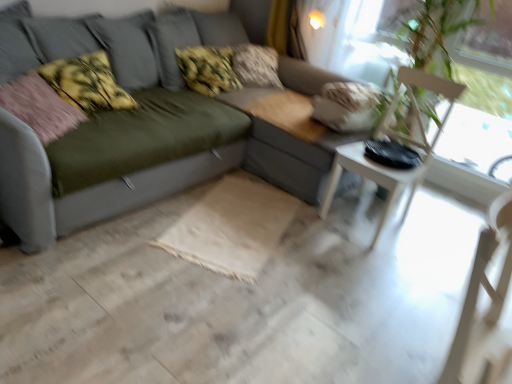
Locate an element on the screen. Image resolution: width=512 pixels, height=384 pixels. free location to the left of white wood armchair at right, marked as the first armchair in a front-to-back arrangement is located at coordinates (333, 361).